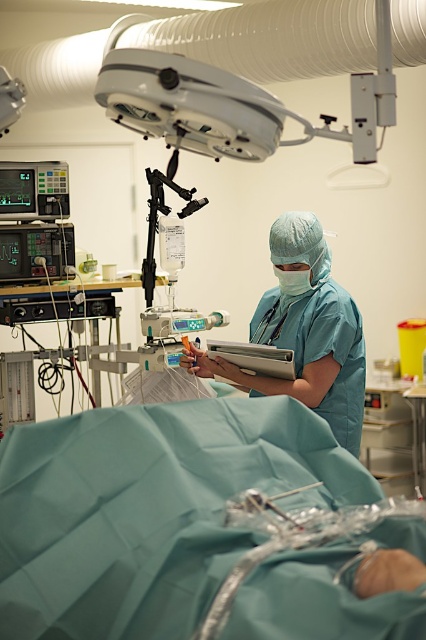
Does white plastic surgical light at upper center appear under teal matte scrubs at center?

No.

Between white plastic surgical light at upper center and teal matte scrubs at center, which one is positioned lower?

teal matte scrubs at center is below.

Locate an element on the screen. The image size is (426, 640). white plastic surgical light at upper center is located at coordinates (233, 100).

Where is `white plastic surgical light at upper center`? white plastic surgical light at upper center is located at coordinates (233, 100).